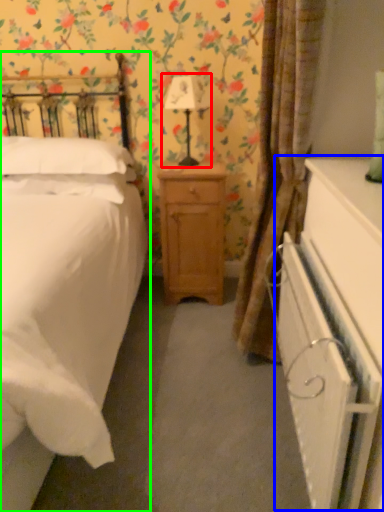
Question: Which object is positioned farthest from bedside lamp (highlighted by a red box)? Select from dresser (highlighted by a blue box) and bed (highlighted by a green box).

Choices:
 (A) dresser
 (B) bed

Answer: (A)